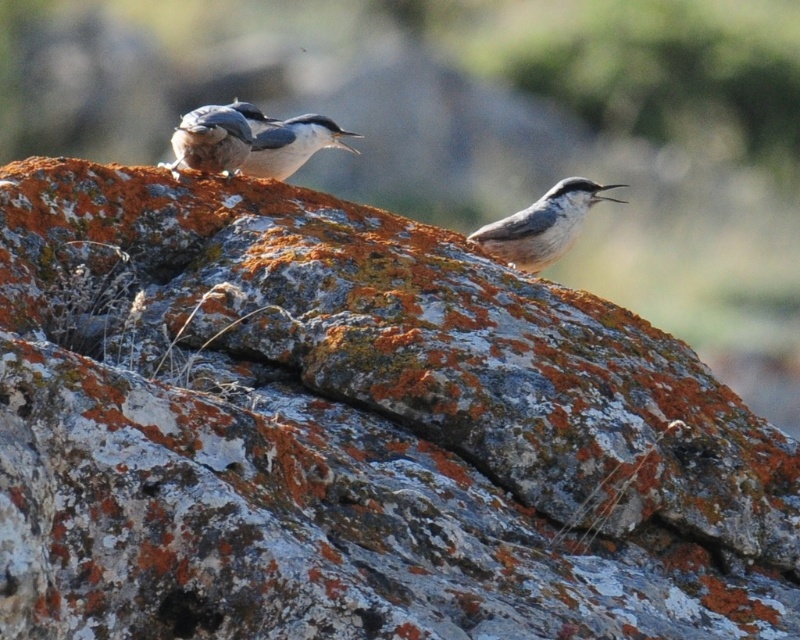
Does brown speckled bird at center appear on the left side of white matte bird at center?

Incorrect, brown speckled bird at center is not on the left side of white matte bird at center.

Does brown speckled bird at center appear over white matte bird at center?

No.

Describe the element at coordinates (542, 225) in the screenshot. I see `brown speckled bird at center` at that location.

The width and height of the screenshot is (800, 640). Identify the location of brown speckled bird at center. (542, 225).

Does matte gray bird at upper left have a lesser width compared to white matte bird at center?

Correct, matte gray bird at upper left's width is less than white matte bird at center's.

Looking at this image, is matte gray bird at upper left further to the viewer compared to white matte bird at center?

That is False.

Between point (266, 122) and point (262, 156), which one is positioned in front?

Point (262, 156) is more forward.

At what (x,y) coordinates should I click in order to perform the action: click on matte gray bird at upper left. Please return your answer as a coordinate pair (x, y). The width and height of the screenshot is (800, 640). Looking at the image, I should click on click(216, 136).

Is the position of brown speckled bird at center more distant than that of matte gray bird at upper left?

Yes.

Between point (556, 221) and point (254, 115), which one is positioned behind?

Point (254, 115)

In order to click on brown speckled bird at center in this screenshot , I will do `click(542, 225)`.